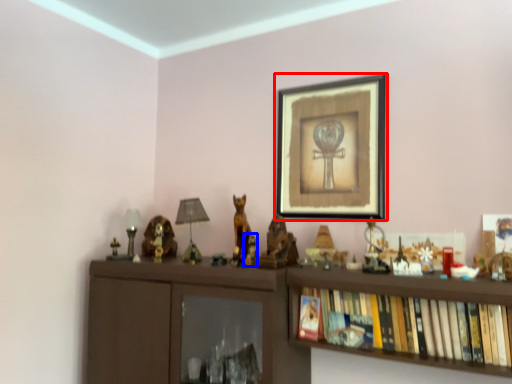
Question: Which object appears closest to the camera in this image, picture frame (highlighted by a red box) or toy (highlighted by a blue box)?

Choices:
 (A) picture frame
 (B) toy

Answer: (A)